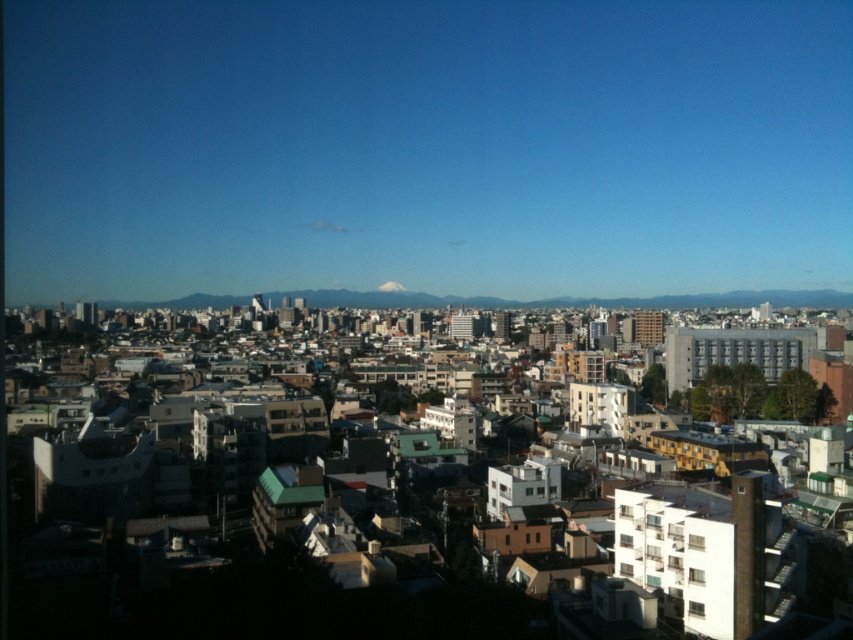
You are a city planner reviewing a satellite image of a city. You notice a white matte building at center. Based on its position in the image coordinates, can you determine if it is located in the upper half or lower half of the image?

The white matte building at center is located at point coordinates with a y value of 0.278. Since the lower half of the image corresponds to y values from 0 to 0.5, the white matte building at center is in the lower half of the image.

You are an architect evaluating a cityscape. You notice the white matte building at center and the snowy mountain peak at center. Which one appears larger in the image?

The white matte building at center appears larger than the snowy mountain peak at center in the image.